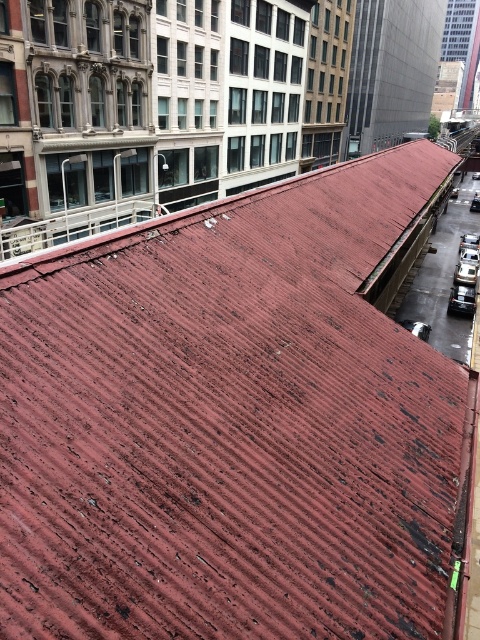
You are standing on the weathered red corrugated metal roof and looking towards the cityscape. There is a point marked at coordinates (462,300). What object is located at that point?

The point at coordinates (462,300) corresponds to the shiny silver car at lower right.

You are standing on the weathered red corrugated metal roof and looking down. You see a shiny silver car at lower right and a white glossy car at lower right. Which car is closer to the roof?

The shiny silver car at lower right is closer to the roof because it is located below the white glossy car at lower right.

From the picture: You are standing on the weathered red corrugated metal roof and looking down at the cars below. Which car is positioned to the left when comparing the shiny silver car at lower right and the white glossy car at lower right?

The shiny silver car at lower right is positioned to the left of the white glossy car at lower right.